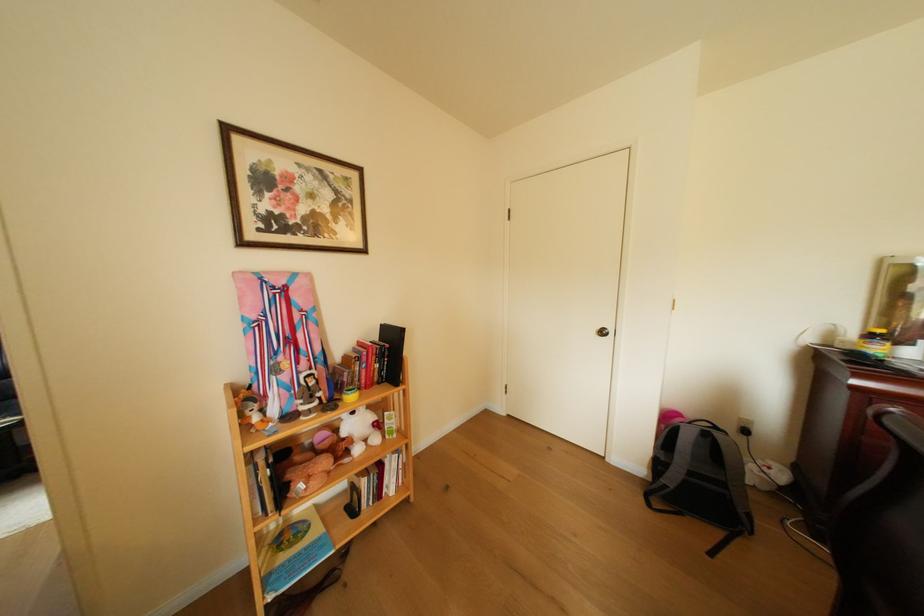
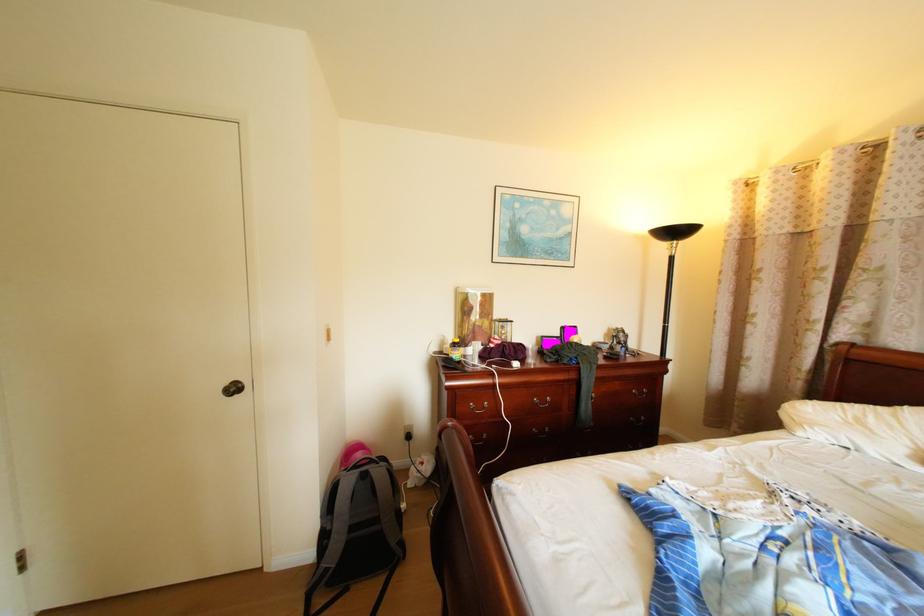
Question: The camera is either moving clockwise (left) or counter-clockwise (right) around the object. The first image is from the beginning of the video and the second image is from the end. Is the camera moving left or right when shooting the video?

Choices:
 (A) Left
 (B) Right

Answer: (A)